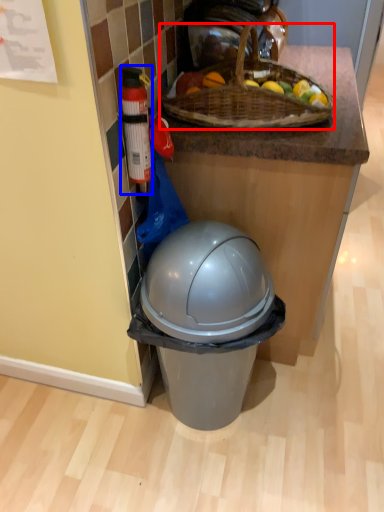
Question: Which of the following is the closest to the observer, picnic basket (highlighted by a red box) or bottle (highlighted by a blue box)?

Choices:
 (A) picnic basket
 (B) bottle

Answer: (B)